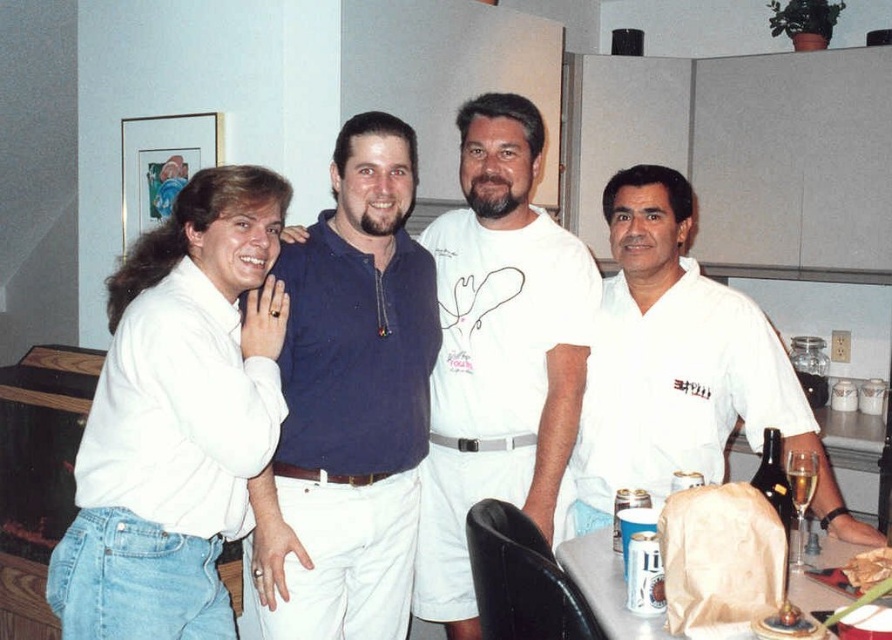
You are trying to decide which shirt to wear for a casual dinner. Both the blue cotton polo shirt at center and the white cotton shirt at center are options. Based on their sizes in the image, which one is narrower?

The blue cotton polo shirt at center is narrower than the white cotton shirt at center according to the description.

You are standing in the kitchen and want to hand a recipe card to both the white matte shirt at left and the blue cotton polo shirt at center. Based on their positions, who should you approach first to ensure you can reach them without walking past the other person?

You should approach the white matte shirt at left first because they are in front of the blue cotton polo shirt at center, so reaching them first avoids needing to walk past the latter.